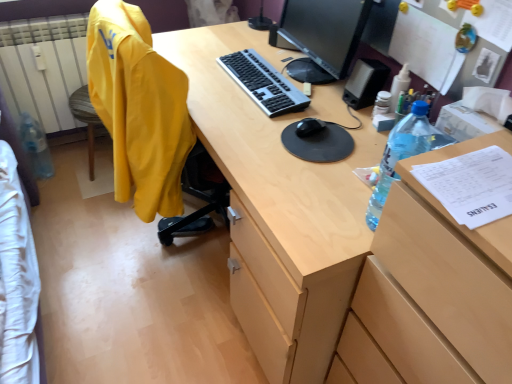
Question: Does matte wood desk at center turn towards wooden file cabinet at right?

Choices:
 (A) yes
 (B) no

Answer: (B)

Question: Is matte wood desk at center behind wooden file cabinet at right?

Choices:
 (A) yes
 (B) no

Answer: (A)

Question: Considering the relative positions of matte wood desk at center and wooden file cabinet at right in the image provided, is matte wood desk at center to the right of wooden file cabinet at right from the viewer's perspective?

Choices:
 (A) yes
 (B) no

Answer: (B)

Question: Can you confirm if matte wood desk at center is thinner than wooden file cabinet at right?

Choices:
 (A) no
 (B) yes

Answer: (A)

Question: Does matte wood desk at center have a greater width compared to wooden file cabinet at right?

Choices:
 (A) no
 (B) yes

Answer: (B)

Question: Is translucent plastic bottle at right, which appears as the 2th bottle when viewed from the back, wider or thinner than black plastic speaker at upper right?

Choices:
 (A) thin
 (B) wide

Answer: (A)

Question: From the image's perspective, is translucent plastic bottle at right, which appears as the 2th bottle when viewed from the back, above or below black plastic speaker at upper right?

Choices:
 (A) below
 (B) above

Answer: (A)

Question: Considering the relative positions of translucent plastic bottle at right, the 2th bottle from the left, and black plastic speaker at upper right in the image provided, is translucent plastic bottle at right, the 2th bottle from the left, to the left or to the right of black plastic speaker at upper right?

Choices:
 (A) right
 (B) left

Answer: (B)

Question: Is translucent plastic bottle at right, which appears as the first bottle when viewed from the front, inside the boundaries of black plastic speaker at upper right, or outside?

Choices:
 (A) outside
 (B) inside

Answer: (A)

Question: From a real-world perspective, is translucent plastic bottle at right, which appears as the first bottle when viewed from the front, physically located above or below white cotton bedsheet at lower left, the second clothing viewed from the right?

Choices:
 (A) below
 (B) above

Answer: (B)

Question: Considering the positions of translucent plastic bottle at right, which appears as the 2th bottle when viewed from the back, and white cotton bedsheet at lower left, the second clothing viewed from the right, in the image, is translucent plastic bottle at right, which appears as the 2th bottle when viewed from the back, taller or shorter than white cotton bedsheet at lower left, the second clothing viewed from the right,?

Choices:
 (A) short
 (B) tall

Answer: (B)

Question: Is point (414, 115) closer or farther from the camera than point (17, 266)?

Choices:
 (A) closer
 (B) farther

Answer: (A)

Question: Would you say translucent plastic bottle at right, which appears as the first bottle when viewed from the front, is inside or outside white cotton bedsheet at lower left, the second clothing viewed from the right?

Choices:
 (A) outside
 (B) inside

Answer: (A)

Question: Does point (410, 124) appear closer or farther from the camera than point (181, 110)?

Choices:
 (A) closer
 (B) farther

Answer: (A)

Question: Looking at their shapes, would you say translucent plastic bottle at right, the 2th bottle from the left, is wider or thinner than yellow fabric jacket at left, the 1th clothing from the right?

Choices:
 (A) wide
 (B) thin

Answer: (B)